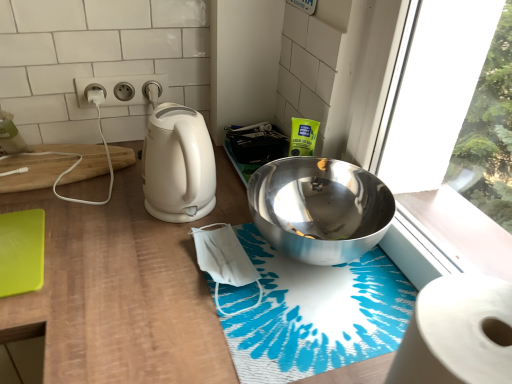
This screenshot has width=512, height=384. What are the coordinates of `silver metallic bowl at upper right` in the screenshot? It's located at (319, 208).

At what (x,y) coordinates should I click in order to perform the action: click on green matte cutting board at lower left, the second cutting board from the top. Please return your answer as a coordinate pair (x, y). The image size is (512, 384). Looking at the image, I should click on (21, 251).

At what (x,y) coordinates should I click in order to perform the action: click on wooden at left. Please return your answer as a coordinate pair (x, y). The image size is (512, 384). Looking at the image, I should click on (96, 217).

Where is `wooden cutting board at left, placed as the first cutting board when sorted from back to front`? The image size is (512, 384). wooden cutting board at left, placed as the first cutting board when sorted from back to front is located at coordinates (33, 171).

Which is closer, (x=167, y=211) or (x=445, y=291)?

Point (x=167, y=211) appears to be farther away from the viewer than point (x=445, y=291).

Does white glossy electric kettle at left come behind white paper at lower right?

Yes, it is.

Considering the relative sizes of white glossy electric kettle at left and white paper at lower right in the image provided, is white glossy electric kettle at left taller than white paper at lower right?

Yes.

From a real-world perspective, who is located lower, white glossy electric kettle at left or white paper at lower right?

white paper at lower right is physically lower.

Where is `the 2nd cutting board below the white matte toilet paper at left (from a real-world perspective)`? the 2nd cutting board below the white matte toilet paper at left (from a real-world perspective) is located at coordinates (21, 251).

Between green matte cutting board at lower left, which is the 1th cutting board in front-to-back order, and white matte toilet paper at left, which one has larger width?

green matte cutting board at lower left, which is the 1th cutting board in front-to-back order.

Looking at this image, is green matte cutting board at lower left, the 2th cutting board positioned from the back, aimed at white matte toilet paper at left?

No, green matte cutting board at lower left, the 2th cutting board positioned from the back, is not facing towards white matte toilet paper at left.

From the image's perspective, is green matte cutting board at lower left, which is counted as the 1th cutting board, starting from the bottom, over white matte toilet paper at left?

No, from the image's perspective, green matte cutting board at lower left, which is counted as the 1th cutting board, starting from the bottom, is not on top of white matte toilet paper at left.

Consider the image. Considering the sizes of objects white plastic electrical outlet at upper center and green matte cutting board at lower left, which is counted as the 1th cutting board, starting from the bottom, in the image provided, who is smaller, white plastic electrical outlet at upper center or green matte cutting board at lower left, which is counted as the 1th cutting board, starting from the bottom,?

With smaller size is white plastic electrical outlet at upper center.

Could you tell me if white plastic electrical outlet at upper center is turned towards green matte cutting board at lower left, the second cutting board from the top?

No.

The width and height of the screenshot is (512, 384). I want to click on the 2nd cutting board in front of the white plastic electrical outlet at upper center, so click(21, 251).

Looking at this image, how many degrees apart are the facing directions of white plastic electrical outlet at upper center and green matte cutting board at lower left, the second cutting board from the top?

white plastic electrical outlet at upper center and green matte cutting board at lower left, the second cutting board from the top, are facing 1.08 degrees away from each other.

Which of these two, white paper at lower right or wooden at left, stands shorter?

With less height is white paper at lower right.

Considering the sizes of white paper at lower right and wooden at left in the image, is white paper at lower right wider or thinner than wooden at left?

In the image, white paper at lower right appears to be more narrow than wooden at left.

Which point is more distant from viewer, (507,360) or (359,370)?

The point (359,370) is farther.

At what (x,y) coordinates should I click in order to perform the action: click on electric outlet that is above the wooden at left (from the image's perspective). Please return your answer as a coordinate pair (x, y). Image resolution: width=512 pixels, height=384 pixels. Looking at the image, I should click on (120, 89).

Can you tell me how much white plastic electrical outlet at upper center and wooden at left differ in facing direction?

90 degrees separate the facing orientations of white plastic electrical outlet at upper center and wooden at left.

Considering the positions of objects white plastic electrical outlet at upper center and wooden at left in the image provided, who is in front, white plastic electrical outlet at upper center or wooden at left?

wooden at left is more forward.

Who is more distant, white matte toilet paper at left or blue printed bath mat at center?

white matte toilet paper at left is further away from the camera.

Considering the sizes of objects white matte toilet paper at left and blue printed bath mat at center in the image provided, who is thinner, white matte toilet paper at left or blue printed bath mat at center?

white matte toilet paper at left is thinner.

Who is smaller, white matte toilet paper at left or blue printed bath mat at center?

white matte toilet paper at left.

Consider the image. Is white matte toilet paper at left facing towards wooden at left?

No, white matte toilet paper at left is not aimed at wooden at left.

Is white matte toilet paper at left positioned beyond the bounds of wooden at left?

Indeed, white matte toilet paper at left is completely outside wooden at left.

Can you confirm if white matte toilet paper at left is bigger than wooden at left?

No, white matte toilet paper at left is not bigger than wooden at left.

The height and width of the screenshot is (384, 512). I want to click on kitchen appliance that is above the white paper at lower right (from a real-world perspective), so click(178, 165).

Locate an element on the screen. toilet paper behind the green matte cutting board at lower left, the second cutting board from the top is located at coordinates (11, 135).

Considering their positions, is white plastic electrical outlet at upper center positioned closer to white glossy electric kettle at left than blue printed bath mat at center?

blue printed bath mat at center is closer to white glossy electric kettle at left.

Based on their spatial positions, is white plastic electrical outlet at upper center or green matte cutting board at lower left, the second cutting board from the top, closer to white glossy electric kettle at left?

Among the two, green matte cutting board at lower left, the second cutting board from the top, is located nearer to white glossy electric kettle at left.

Looking at this image, which object lies further to the anchor point green matte cutting board at lower left, the 2th cutting board positioned from the back, white paper at lower right or white plastic electrical outlet at upper center?

The object further to green matte cutting board at lower left, the 2th cutting board positioned from the back, is white paper at lower right.

Looking at the image, which one is located closer to white plastic electrical outlet at upper center, wooden cutting board at left, the 2th cutting board positioned from the front, or wooden at left?

wooden cutting board at left, the 2th cutting board positioned from the front, lies closer to white plastic electrical outlet at upper center than the other object.

From the image, which object appears to be nearer to green matte cutting board at lower left, which is the 1th cutting board in front-to-back order, blue printed bath mat at center or wooden at left?

wooden at left is positioned closer to the anchor green matte cutting board at lower left, which is the 1th cutting board in front-to-back order.

Considering their positions, is white glossy electric kettle at left positioned further to wooden cutting board at left, placed as the first cutting board when sorted from back to front, than white plastic electrical outlet at upper center?

white glossy electric kettle at left is positioned further to the anchor wooden cutting board at left, placed as the first cutting board when sorted from back to front.

Based on their spatial positions, is green matte cutting board at lower left, which is counted as the 1th cutting board, starting from the bottom, or blue printed bath mat at center closer to white paper at lower right?

Among the two, blue printed bath mat at center is located nearer to white paper at lower right.

Based on their spatial positions, is wooden cutting board at left, positioned as the second cutting board in bottom-to-top order, or wooden at left closer to white glossy electric kettle at left?

Among the two, wooden at left is located nearer to white glossy electric kettle at left.

This screenshot has height=384, width=512. Find the location of `electric outlet between green matte cutting board at lower left, the 2th cutting board positioned from the back, and blue printed bath mat at center from left to right`. electric outlet between green matte cutting board at lower left, the 2th cutting board positioned from the back, and blue printed bath mat at center from left to right is located at coordinates (120, 89).

I want to click on bath mat located between white paper at lower right and white plastic electrical outlet at upper center in the depth direction, so click(316, 314).

At what (x,y) coordinates should I click in order to perform the action: click on counter between white matte toilet paper at left and blue printed bath mat at center. Please return your answer as a coordinate pair (x, y). Looking at the image, I should click on (96, 217).

Image resolution: width=512 pixels, height=384 pixels. Find the location of `electric outlet located between green matte cutting board at lower left, which is the 1th cutting board in front-to-back order, and silver metallic bowl at upper right in the left-right direction`. electric outlet located between green matte cutting board at lower left, which is the 1th cutting board in front-to-back order, and silver metallic bowl at upper right in the left-right direction is located at coordinates (120, 89).